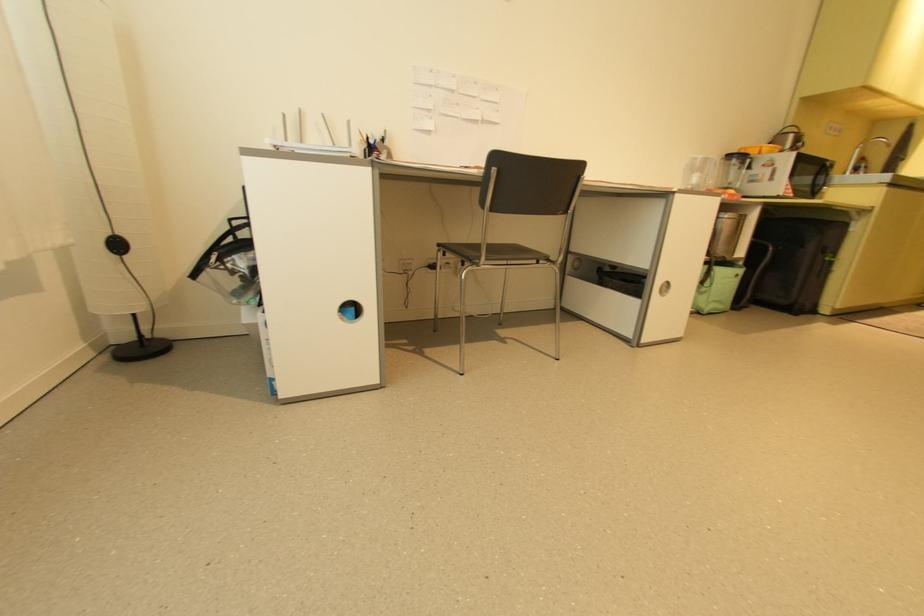
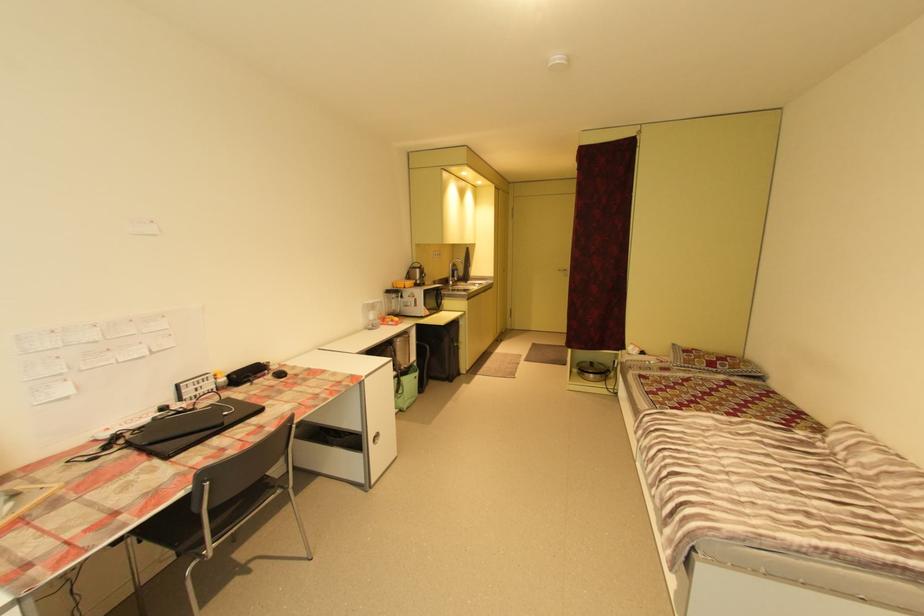
In the second image, find the point that corresponds to pixel 711 293 in the first image.

(407, 397)